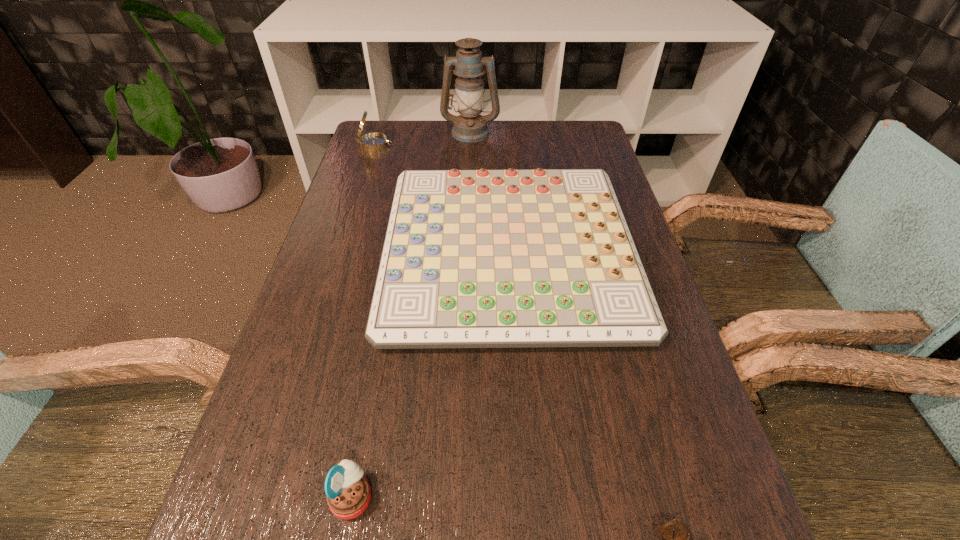
In the image, there is a desktop. Where is `blank space at the far right corner`? blank space at the far right corner is located at coordinates (579, 129).

You are a GUI agent. You are given a task and a screenshot of the screen. Output one action in this format:
    pyautogui.click(x=<x>, y=<y>)
    Task: Click on the vacant region between the taller compass and the oil lamp
    The image size is (960, 540).
    Given the screenshot: What is the action you would take?
    pyautogui.click(x=423, y=138)

Locate an element on the screen. free spot between the muffin and the taller compass is located at coordinates (365, 321).

Where is `unoccupied position between the leftmost object and the second nearest object`? Image resolution: width=960 pixels, height=540 pixels. unoccupied position between the leftmost object and the second nearest object is located at coordinates (365, 321).

Where is `free point between the leftmost object and the fourth farthest object`? free point between the leftmost object and the fourth farthest object is located at coordinates (x=365, y=321).

Locate an element on the screen. This screenshot has width=960, height=540. vacant area between the farther compass and the muffin is located at coordinates (365, 321).

This screenshot has width=960, height=540. Identify the location of vacant area that lies between the second shortest object and the second nearest object. (431, 375).

Where is `the closest object relative to the shortest object`? the closest object relative to the shortest object is located at coordinates (516, 258).

At what (x,y) coordinates should I click in order to perform the action: click on object that is the nearest to the gameboard. Please return your answer as a coordinate pair (x, y). The height and width of the screenshot is (540, 960). Looking at the image, I should click on (374, 141).

Identify the location of vacant space that satisfies the following two spatial constraints: 1. with the dial facing the third nearest object; 2. on the right side of the left compass. (342, 252).